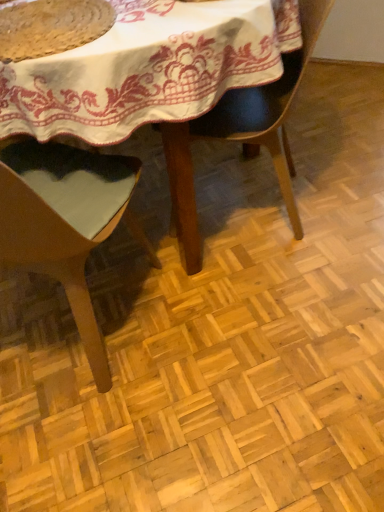
At what (x,y) coordinates should I click in order to perform the action: click on space that is in front of light brown wood chair at center, arranged as the second chair when viewed from the right. Please return your answer as a coordinate pair (x, y). This screenshot has width=384, height=512. Looking at the image, I should click on click(x=109, y=436).